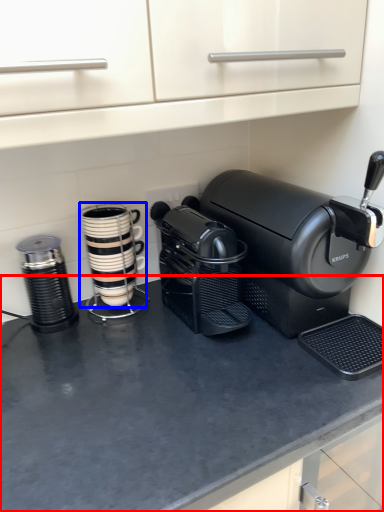
Question: Which object is closer to the camera taking this photo, counter top (highlighted by a red box) or kitchen appliance (highlighted by a blue box)?

Choices:
 (A) counter top
 (B) kitchen appliance

Answer: (A)